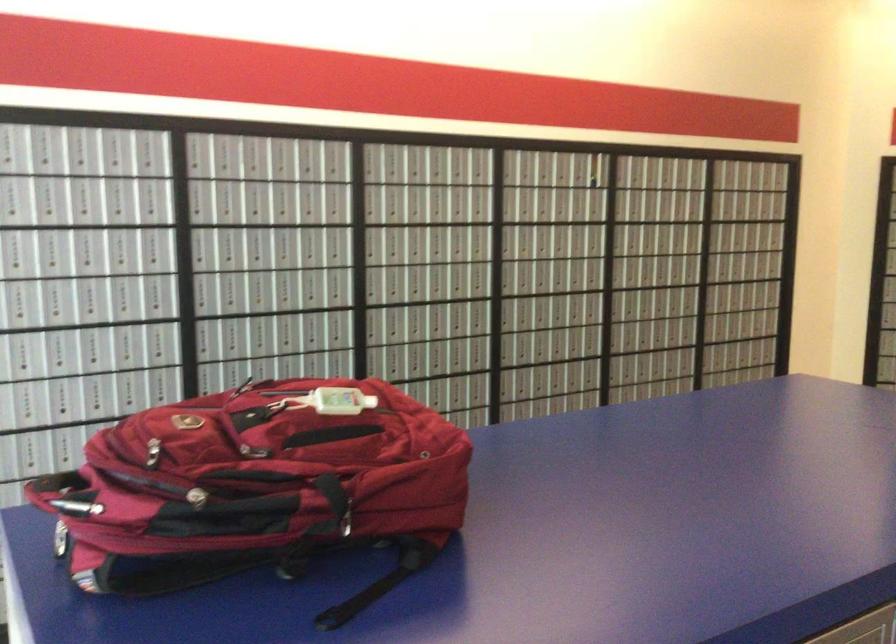
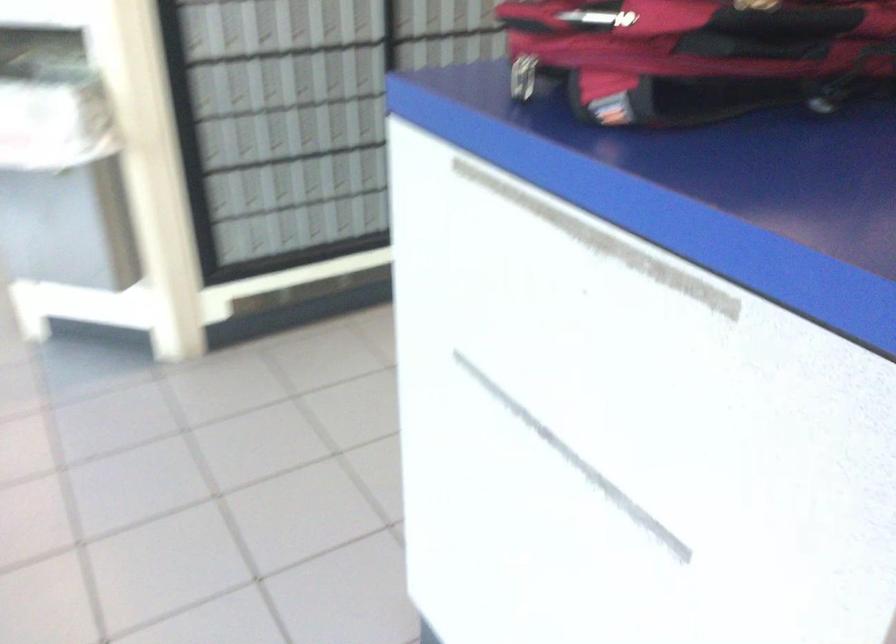
Question: The images are taken continuously from a first-person perspective. In which direction are you moving?

Choices:
 (A) Left
 (B) Right
 (C) Forward
 (D) Backward

Answer: (A)